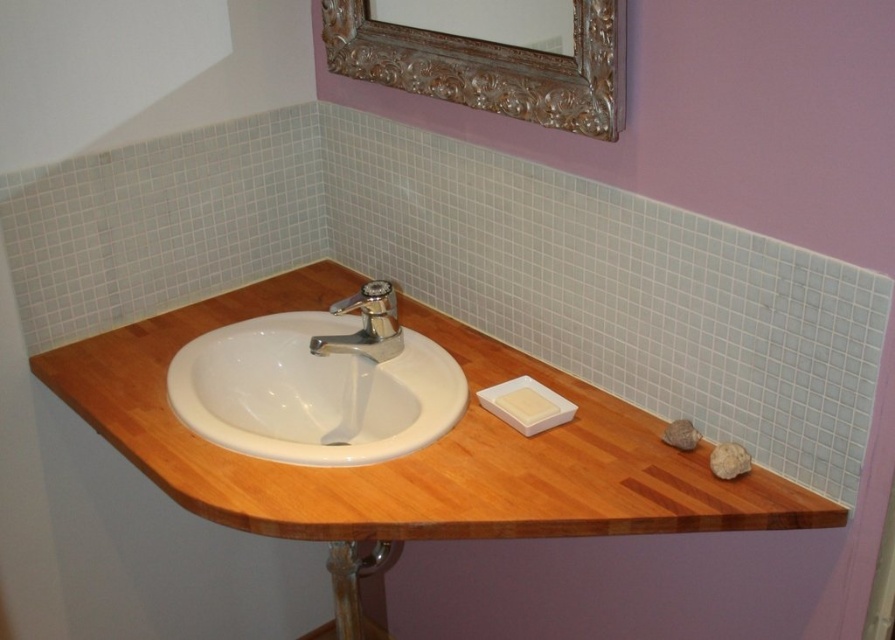
Question: Estimate the real-world distances between objects in this image. Which object is closer to the wooden counter top at center?

Choices:
 (A) white ceramic sink at center
 (B) wooden stool at lower center
 (C) gold ornate mirror at upper center
 (D) white matte soap at center

Answer: (A)

Question: Estimate the real-world distances between objects in this image. Which object is closer to the white ceramic sink at center?

Choices:
 (A) white matte soap at center
 (B) wooden stool at lower center

Answer: (B)

Question: Which is nearer to the gold ornate mirror at upper center?

Choices:
 (A) polished chrome faucet at center
 (B) white matte soap at center
 (C) wooden stool at lower center

Answer: (A)

Question: Observing the image, what is the correct spatial positioning of wooden counter top at center in reference to polished chrome faucet at center?

Choices:
 (A) right
 (B) left

Answer: (A)

Question: Is gold ornate mirror at upper center to the right of wooden stool at lower center from the viewer's perspective?

Choices:
 (A) yes
 (B) no

Answer: (A)

Question: Is wooden counter top at center to the right of white ceramic sink at center from the viewer's perspective?

Choices:
 (A) no
 (B) yes

Answer: (B)